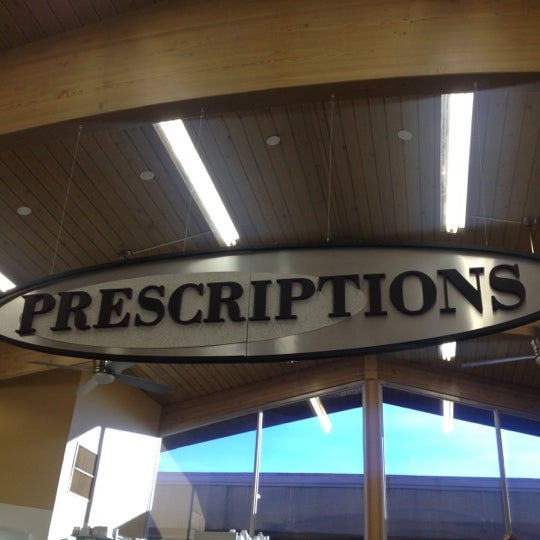
Identify the location of fluorescent lights. This screenshot has width=540, height=540. (209, 202), (459, 208), (449, 351).